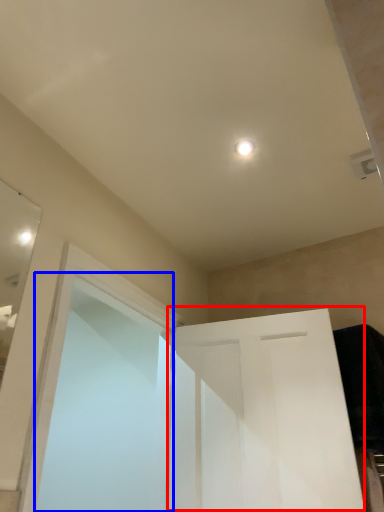
Question: Which object is further to the camera taking this photo, door (highlighted by a red box) or screen door (highlighted by a blue box)?

Choices:
 (A) door
 (B) screen door

Answer: (A)